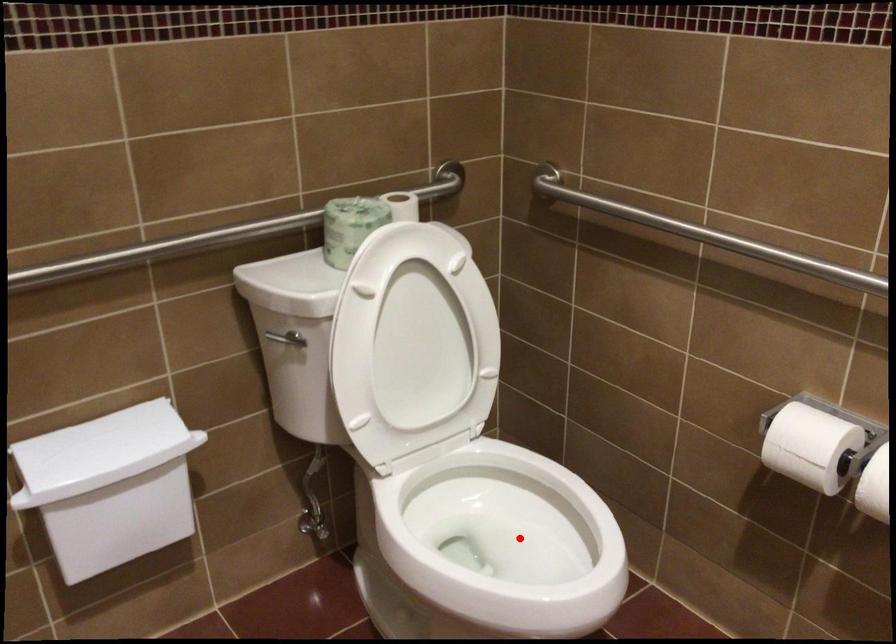
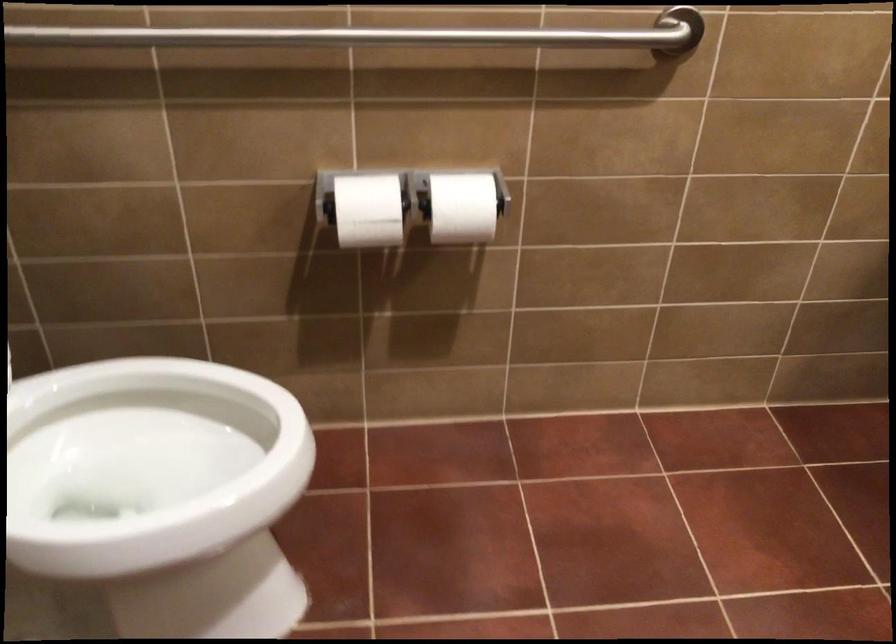
Question: I am providing you with two images of the same scene from different viewpoints. Image1 has a red point marked. In image2, the corresponding 3D location appears at what relative position? Reply with the corresponding letter.

Choices:
 (A) Closer
 (B) Farther

Answer: (A)